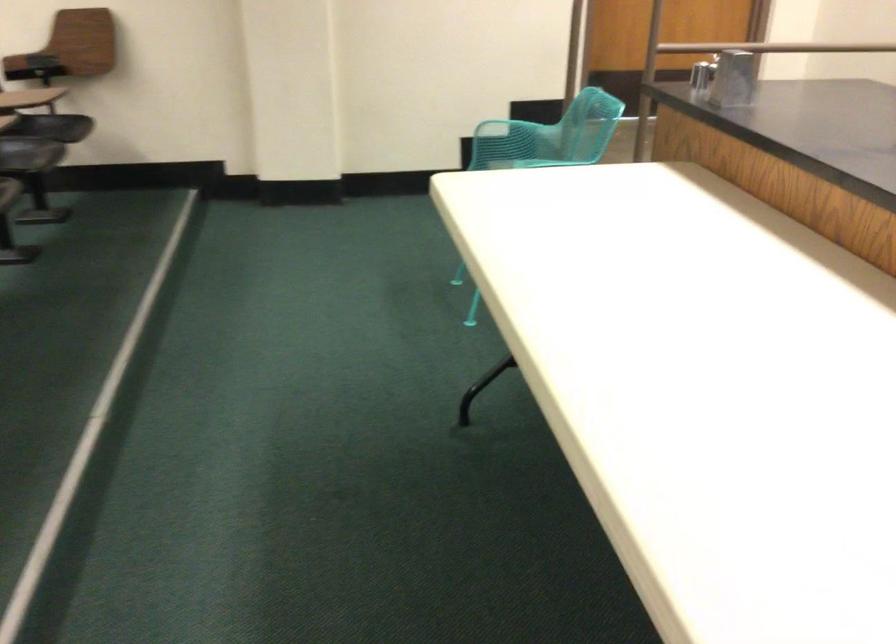
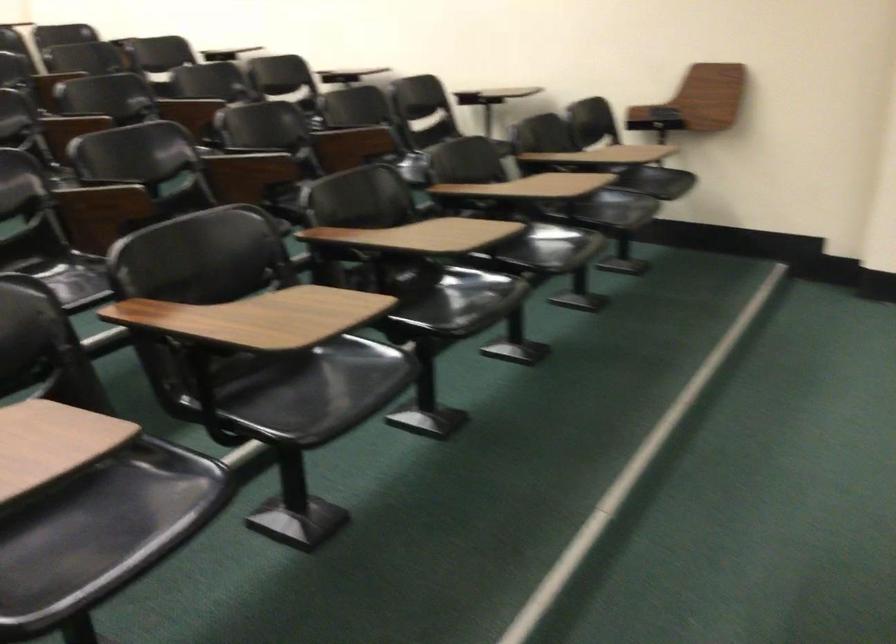
Question: The first image is from the beginning of the video and the second image is from the end. How did the camera likely rotate when shooting the video?

Choices:
 (A) Left
 (B) Right
 (C) Up
 (D) Down

Answer: (A)